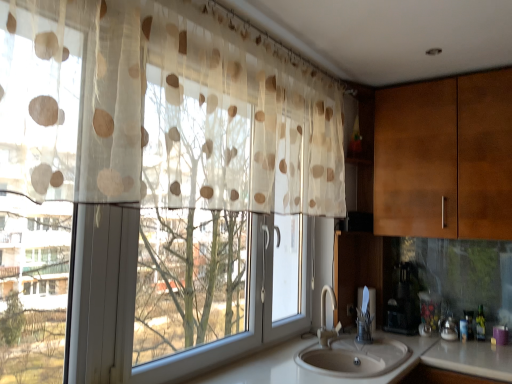
What do you see at coordinates (353, 357) in the screenshot? This screenshot has width=512, height=384. I see `white ceramic sink at lower center` at bounding box center [353, 357].

What do you see at coordinates (445, 158) in the screenshot? The image size is (512, 384). I see `wooden cabinet at right` at bounding box center [445, 158].

The width and height of the screenshot is (512, 384). Identify the location of translucent beige polka dot curtain at left. (163, 110).

Locate an element on the screen. This screenshot has height=384, width=512. white ceramic sink at lower center is located at coordinates (353, 357).

Is black plastic coffee maker at lower right looking in the opposite direction of wooden cabinet at right?

That's not correct — black plastic coffee maker at lower right is not looking away from wooden cabinet at right.

Choose the correct answer: Is black plastic coffee maker at lower right inside wooden cabinet at right or outside it?

black plastic coffee maker at lower right cannot be found inside wooden cabinet at right.

Relative to wooden cabinet at right, is black plastic coffee maker at lower right in front or behind?

black plastic coffee maker at lower right is positioned farther from the viewer than wooden cabinet at right.

Is black plastic coffee maker at lower right far from wooden cabinet at right?

No.

Between translucent plastic bottle at sink right and wooden cabinet at right, which one has more height?

Standing taller between the two is wooden cabinet at right.

Which object is wider, translucent plastic bottle at sink right or wooden cabinet at right?

With larger width is wooden cabinet at right.

From a real-world perspective, is translucent plastic bottle at sink right below wooden cabinet at right?

Yes.

Consider the image. Which object is thinner, translucent beige polka dot curtain at left or wooden cabinet at right?

Thinner between the two is translucent beige polka dot curtain at left.

Who is smaller, translucent beige polka dot curtain at left or wooden cabinet at right?

wooden cabinet at right.

Could you tell me if translucent beige polka dot curtain at left is turned towards wooden cabinet at right?

No, translucent beige polka dot curtain at left does not turn towards wooden cabinet at right.

Which is behind, translucent beige polka dot curtain at left or wooden cabinet at right?

wooden cabinet at right is further away from the camera.

Looking at the image, does translucent beige polka dot curtain at left seem bigger or smaller compared to white glossy counter top at lower center?

Clearly, translucent beige polka dot curtain at left is smaller in size than white glossy counter top at lower center.

From a real-world perspective, is translucent beige polka dot curtain at left physically located above or below white glossy counter top at lower center?

From a real-world perspective, translucent beige polka dot curtain at left is physically above white glossy counter top at lower center.

Which is less distant, (37, 152) or (329, 379)?

Point (37, 152) is positioned closer to the camera compared to point (329, 379).

Would you say white glossy counter top at lower center is outside black plastic coffee maker at lower right?

Yes, white glossy counter top at lower center is not within black plastic coffee maker at lower right.

Which of these two, white glossy counter top at lower center or black plastic coffee maker at lower right, stands shorter?

black plastic coffee maker at lower right.

Considering the sizes of white glossy counter top at lower center and black plastic coffee maker at lower right in the image, is white glossy counter top at lower center bigger or smaller than black plastic coffee maker at lower right?

Considering their sizes, white glossy counter top at lower center takes up more space than black plastic coffee maker at lower right.

From the image's perspective, which is below, wooden cabinet at right or white ceramic sink at lower center?

From the image's view, white ceramic sink at lower center is below.

Between wooden cabinet at right and white ceramic sink at lower center, which one has larger size?

wooden cabinet at right.

From a real-world perspective, is wooden cabinet at right under white ceramic sink at lower center?

No.

Which object is thinner, wooden cabinet at right or white ceramic sink at lower center?

With smaller width is wooden cabinet at right.

Looking at this image, does white ceramic sink at lower center have a lesser width compared to wooden cabinet at right?

Incorrect, the width of white ceramic sink at lower center is not less than that of wooden cabinet at right.

Is point (389, 349) behind point (511, 173)?

That is True.

In the image, is white ceramic sink at lower center positioned in front of or behind wooden cabinet at right?

In the image, white ceramic sink at lower center appears in front of wooden cabinet at right.

What are the coordinates of `cabinetry on the right of black plastic coffee maker at lower right` in the screenshot? It's located at (445, 158).

The width and height of the screenshot is (512, 384). Find the location of `bottle below the wooden cabinet at right (from a real-world perspective)`. bottle below the wooden cabinet at right (from a real-world perspective) is located at coordinates (480, 325).

Estimate the real-world distances between objects in this image. Which object is further from translucent plastic bottle at sink right, translucent beige polka dot curtain at left or white glossy counter top at lower center?

translucent beige polka dot curtain at left is positioned further to the anchor translucent plastic bottle at sink right.

Considering their positions, is black plastic coffee maker at lower right positioned further to white glossy counter top at lower center than white ceramic sink at lower center?

black plastic coffee maker at lower right is further to white glossy counter top at lower center.

Considering their positions, is wooden cabinet at right positioned closer to translucent plastic bottle at sink right than white ceramic sink at lower center?

Based on the image, white ceramic sink at lower center appears to be nearer to translucent plastic bottle at sink right.

Which object lies further to the anchor point black plastic coffee maker at lower right, translucent plastic bottle at sink right or white ceramic sink at lower center?

Based on the image, white ceramic sink at lower center appears to be further to black plastic coffee maker at lower right.

Which object lies nearer to the anchor point wooden cabinet at right, white glossy counter top at lower center or translucent beige polka dot curtain at left?

Among the two, white glossy counter top at lower center is located nearer to wooden cabinet at right.

Which object lies nearer to the anchor point translucent beige polka dot curtain at left, wooden cabinet at right or white glossy counter top at lower center?

Among the two, white glossy counter top at lower center is located nearer to translucent beige polka dot curtain at left.

Estimate the real-world distances between objects in this image. Which object is closer to wooden cabinet at right, white ceramic sink at lower center or white glossy counter top at lower center?

Among the two, white glossy counter top at lower center is located nearer to wooden cabinet at right.

Which object lies nearer to the anchor point white ceramic sink at lower center, wooden cabinet at right or white glossy counter top at lower center?

white glossy counter top at lower center lies closer to white ceramic sink at lower center than the other object.

Find the location of `counter top located between translucent beige polka dot curtain at left and black plastic coffee maker at lower right in the depth direction`. counter top located between translucent beige polka dot curtain at left and black plastic coffee maker at lower right in the depth direction is located at coordinates (371, 377).

Where is `sink located between translucent beige polka dot curtain at left and black plastic coffee maker at lower right in the depth direction`? This screenshot has height=384, width=512. sink located between translucent beige polka dot curtain at left and black plastic coffee maker at lower right in the depth direction is located at coordinates (353, 357).

Where is `appliance between wooden cabinet at right and translucent plastic bottle at sink right vertically`? This screenshot has height=384, width=512. appliance between wooden cabinet at right and translucent plastic bottle at sink right vertically is located at coordinates (403, 304).

The image size is (512, 384). Find the location of `sink located between white glossy counter top at lower center and translucent plastic bottle at sink right in the depth direction`. sink located between white glossy counter top at lower center and translucent plastic bottle at sink right in the depth direction is located at coordinates (353, 357).